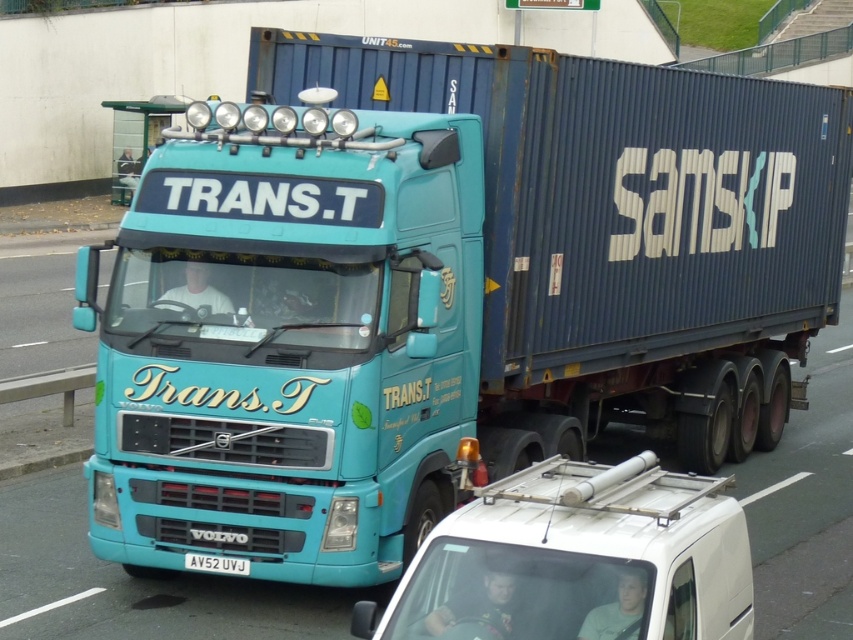
You are standing on the grassy area next to the road where the teal Volvo truck is driving. You see the point marked at coordinate (578, 561). What object is located at that point?

The point at coordinate (578, 561) corresponds to the white matte van at center.

In the scene shown: You are a photographer trying to capture the white matte van at center and the white plastic license plate at center in the same frame. Given that your camera can only focus on objects within a 100cm width, will both objects fit in the frame?

The white matte van at center is wider than the white plastic license plate at center. Since the camera can only focus on objects within a 100cm width, the van may take up most of the frame, but both objects should still fit as long as their combined width doesn